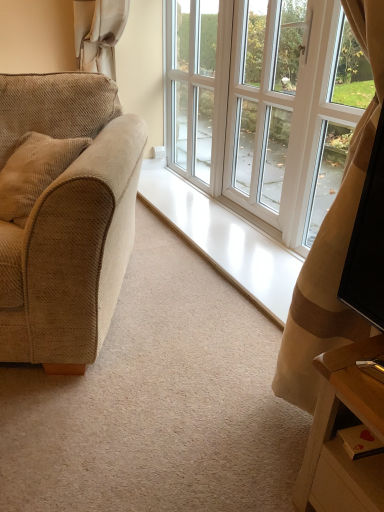
Identify the location of vacant space to the left of white glass window at center. The height and width of the screenshot is (512, 384). pos(146,368).